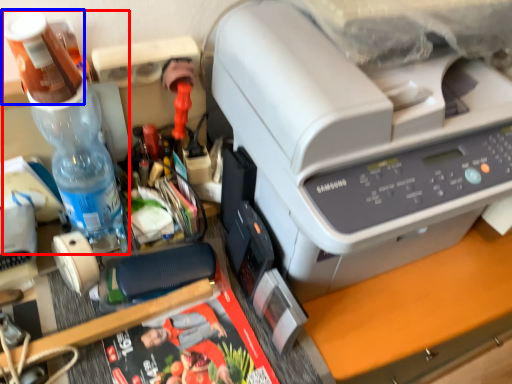
Question: Among these objects, which one is nearest to the camera, bottle (highlighted by a red box) or stationery (highlighted by a blue box)?

Choices:
 (A) bottle
 (B) stationery

Answer: (B)